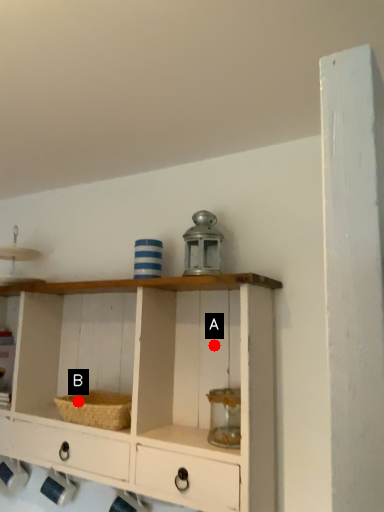
Question: Two points are circled on the image, labeled by A and B beside each circle. Which of the following is the farthest from the observer?

Choices:
 (A) A is further
 (B) B is further

Answer: (B)